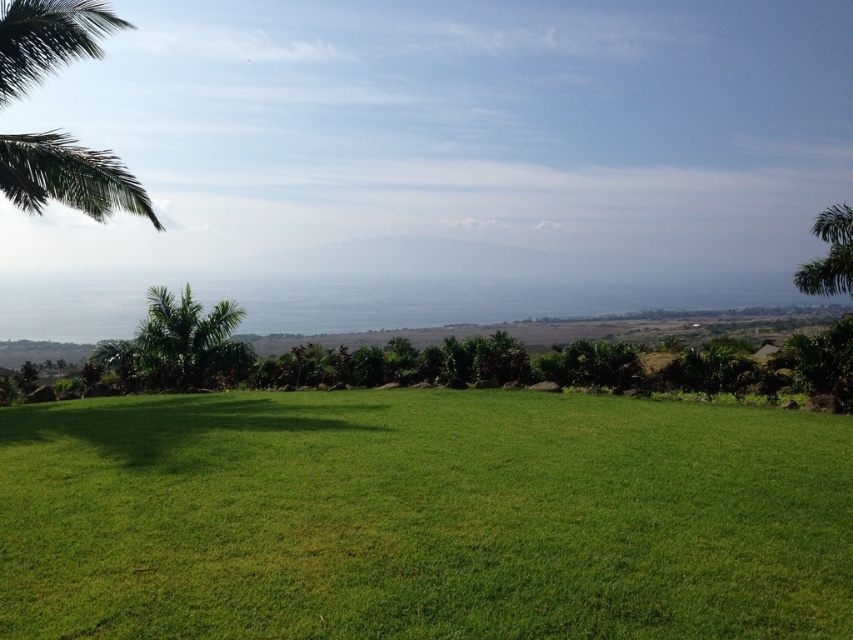
Question: Which object is positioned closest to the green leafy palm at upper left?

Choices:
 (A) green leafy palm tree at lower left
 (B) green leafy palm tree at right
 (C) green grassy field at center

Answer: (A)

Question: Can you confirm if green leafy palm at upper left is bigger than green leafy palm tree at lower left?

Choices:
 (A) no
 (B) yes

Answer: (B)

Question: Considering the relative positions of green grassy field at center and green leafy palm tree at right in the image provided, where is green grassy field at center located with respect to green leafy palm tree at right?

Choices:
 (A) right
 (B) left

Answer: (B)

Question: Does green grassy field at center have a greater width compared to green leafy palm tree at lower left?

Choices:
 (A) no
 (B) yes

Answer: (A)

Question: Which of the following is the closest to the observer?

Choices:
 (A) green leafy palm tree at right
 (B) green leafy palm tree at lower left
 (C) green grassy field at center
 (D) green leafy palm at upper left

Answer: (C)

Question: Which point appears farthest from the camera in this image?

Choices:
 (A) (840, 227)
 (B) (535, 481)
 (C) (234, 326)
 (D) (142, 189)

Answer: (C)